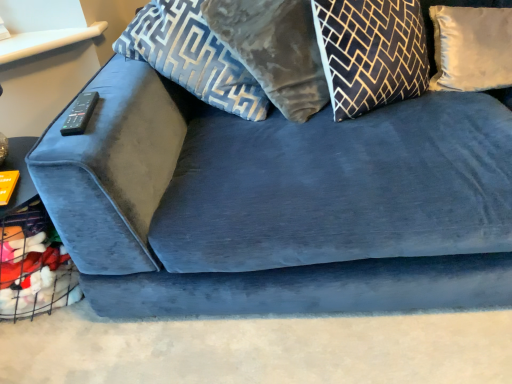
Question: From a real-world perspective, relative to velvet blue pillow at upper center, acting as the fourth pillow starting from the right, is white satin pillow at upper right, which is the first pillow in right-to-left order, vertically above or below?

Choices:
 (A) above
 (B) below

Answer: (B)

Question: From the image's perspective, is white satin pillow at upper right, which is the first pillow in right-to-left order, positioned above or below velvet blue pillow at upper center, which ranks as the first pillow in left-to-right order?

Choices:
 (A) below
 (B) above

Answer: (A)

Question: Based on their relative distances, which object is farther from the velvet blue pillow at upper center, acting as the fourth pillow starting from the right?

Choices:
 (A) velvet gray pillow at upper center, which appears as the 3th pillow when viewed from the right
 (B) white satin pillow at upper right, which is the first pillow in right-to-left order
 (C) black and gold geometric pillow at upper center, which is the second pillow in right-to-left order
 (D) black plastic remote at upper left

Answer: (B)

Question: Which object is positioned farthest from the velvet blue pillow at upper center, which ranks as the first pillow in left-to-right order?

Choices:
 (A) velvet gray pillow at upper center, placed as the second pillow when sorted from left to right
 (B) black plastic remote at upper left
 (C) black and gold geometric pillow at upper center, which is the second pillow in right-to-left order
 (D) white satin pillow at upper right, which is the first pillow in right-to-left order

Answer: (D)